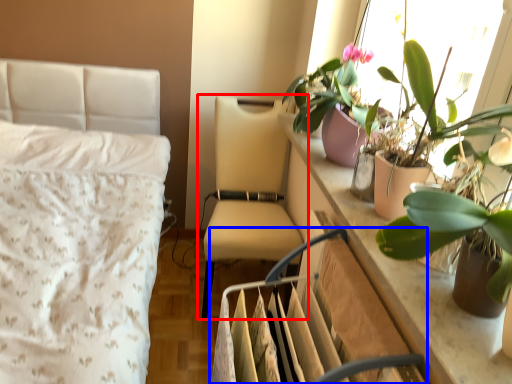
Question: Which object appears closest to the camera in this image, chair (highlighted by a red box) or swivel chair (highlighted by a blue box)?

Choices:
 (A) chair
 (B) swivel chair

Answer: (B)